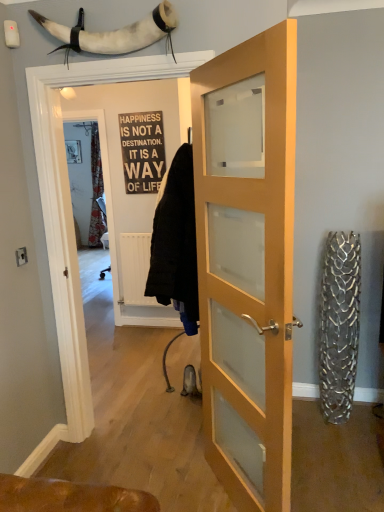
In order to click on vacant space in white horn at upper center (from a real-world perspective) in this screenshot , I will do [133, 456].